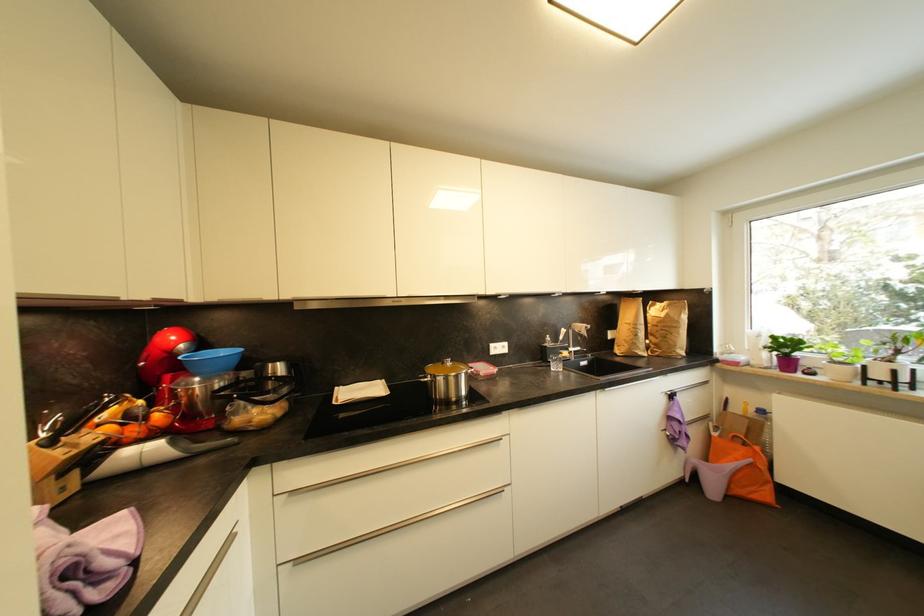
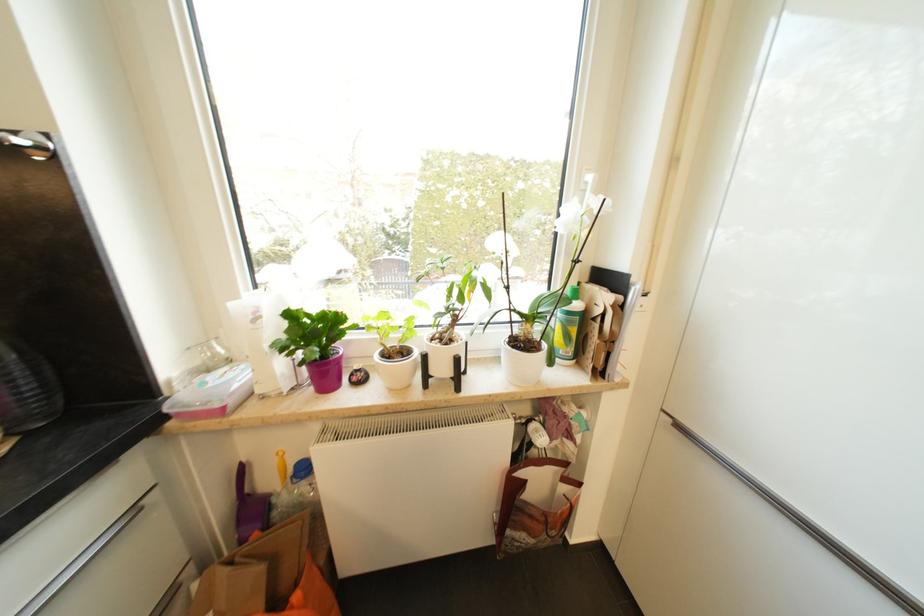
Find the pixel in the second image that matches (777,339) in the first image.

(295, 317)